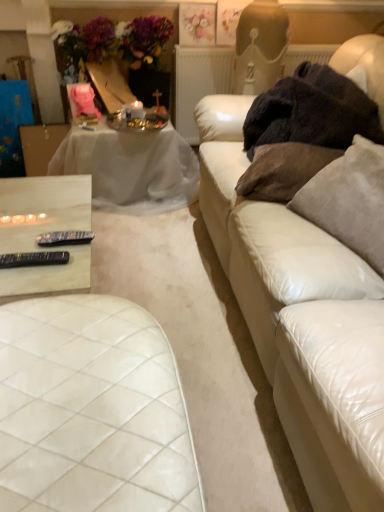
This screenshot has width=384, height=512. Describe the element at coordinates (33, 259) in the screenshot. I see `black plastic remote control at lower left, the 1th tableware when ordered from bottom to top` at that location.

Image resolution: width=384 pixels, height=512 pixels. What do you see at coordinates (42, 209) in the screenshot? I see `white marble remote controls at lower left, which is counted as the first table, starting from the front` at bounding box center [42, 209].

Find the location of a particular element. Image resolution: width=384 pixels, height=512 pixels. white marble remote controls at lower left, the 2th table in the back-to-front sequence is located at coordinates (42, 209).

In order to face pastel floral print at upper center, should I rotate leftwards or rightwards?

A 0.760 degree turn to the right will do.

Describe the element at coordinates (199, 23) in the screenshot. The height and width of the screenshot is (512, 384). I see `pastel floral print at upper center` at that location.

The image size is (384, 512). What do you see at coordinates (91, 410) in the screenshot? I see `white quilted leather ottoman at lower left` at bounding box center [91, 410].

Measure the distance between white quilted leather ottoman at lower left and camera.

The depth of white quilted leather ottoman at lower left is 31.48 inches.

Where is `white sheer cloth at upper left, marked as the 2th table in a front-to-back arrangement`? white sheer cloth at upper left, marked as the 2th table in a front-to-back arrangement is located at coordinates (131, 168).

Image resolution: width=384 pixels, height=512 pixels. I want to click on black plastic remote control at lower left, the first tableware positioned from the front, so click(x=33, y=259).

Measure the distance from pastel floral print at upper center to dark fuzzy blanket at right.

A distance of 1.10 meters exists between pastel floral print at upper center and dark fuzzy blanket at right.

Considering the positions of points (185, 22) and (327, 122), is point (185, 22) closer to camera compared to point (327, 122)?

No, (185, 22) is behind (327, 122).

Identify the location of flower behind the dark fuzzy blanket at right. (199, 23).

Does pastel floral print at upper center have a lesser width compared to dark fuzzy blanket at right?

Indeed, pastel floral print at upper center has a lesser width compared to dark fuzzy blanket at right.

Is black plastic remote control at lower left, which appears as the first tableware when viewed from the top, far away from black plastic remote control at lower left, the 1th tableware when ordered from bottom to top?

No, black plastic remote control at lower left, which appears as the first tableware when viewed from the top, is in close proximity to black plastic remote control at lower left, the 1th tableware when ordered from bottom to top.

You are a GUI agent. You are given a task and a screenshot of the screen. Output one action in this format:
    pyautogui.click(x=<x>, y=<y>)
    Task: Click on the tableware above the black plastic remote control at lower left, the first tableware positioned from the front (from the image's perspective)
    This screenshot has height=512, width=384.
    Given the screenshot: What is the action you would take?
    pyautogui.click(x=64, y=238)

Between black plastic remote control at lower left, marked as the 1th tableware in a back-to-front arrangement, and black plastic remote control at lower left, the 2th tableware in the back-to-front sequence, which one has more height?

Standing taller between the two is black plastic remote control at lower left, marked as the 1th tableware in a back-to-front arrangement.

From the picture: Does black plastic remote control at lower left, which appears as the first tableware when viewed from the top, have a greater width compared to black plastic remote control at lower left, arranged as the 2th tableware when viewed from the top?

Yes.

Consider the image. In terms of size, does brown fabric pillow at right, which ranks as the second pillow in right-to-left order, appear bigger or smaller than dark fuzzy blanket at right?

Clearly, brown fabric pillow at right, which ranks as the second pillow in right-to-left order, is smaller in size than dark fuzzy blanket at right.

From a real-world perspective, is brown fabric pillow at right, which ranks as the first pillow in left-to-right order, on dark fuzzy blanket at right?

No.

Can you tell me how much brown fabric pillow at right, which ranks as the first pillow in left-to-right order, and dark fuzzy blanket at right differ in facing direction?

The angular difference between brown fabric pillow at right, which ranks as the first pillow in left-to-right order, and dark fuzzy blanket at right is 12.7 degrees.

Is brown fabric pillow at right, which ranks as the second pillow in right-to-left order, with dark fuzzy blanket at right?

No, brown fabric pillow at right, which ranks as the second pillow in right-to-left order, is not touching dark fuzzy blanket at right.

Between brown fabric pillow at right, which ranks as the first pillow in left-to-right order, and white marble remote controls at lower left, which is counted as the first table, starting from the front, which one is positioned in front?

white marble remote controls at lower left, which is counted as the first table, starting from the front.

Considering the relative sizes of brown fabric pillow at right, which ranks as the first pillow in left-to-right order, and white marble remote controls at lower left, which is counted as the first table, starting from the front, in the image provided, is brown fabric pillow at right, which ranks as the first pillow in left-to-right order, shorter than white marble remote controls at lower left, which is counted as the first table, starting from the front,?

Yes.

Is brown fabric pillow at right, which ranks as the second pillow in right-to-left order, bigger than white marble remote controls at lower left, which is counted as the first table, starting from the front?

Incorrect, brown fabric pillow at right, which ranks as the second pillow in right-to-left order, is not larger than white marble remote controls at lower left, which is counted as the first table, starting from the front.

From the white marble remote controls at lower left, marked as the first table in a bottom-to-top arrangement, count 1st pillow to the right and point to it. Please provide its 2D coordinates.

[(283, 170)]

Can white leather couch at right be found inside black plastic remote control at lower left, which appears as the first tableware when viewed from the top?

No.

Is black plastic remote control at lower left, the 2th tableware from the front, bigger or smaller than white leather couch at right?

In the image, black plastic remote control at lower left, the 2th tableware from the front, appears to be smaller than white leather couch at right.

Considering the positions of points (57, 234) and (213, 234), is point (57, 234) farther from camera compared to point (213, 234)?

No, (57, 234) is closer to viewer.

Is black plastic remote control at lower left, marked as the 1th tableware in a back-to-front arrangement, thinner than white leather couch at right?

Correct, the width of black plastic remote control at lower left, marked as the 1th tableware in a back-to-front arrangement, is less than that of white leather couch at right.

Does point (16, 202) come in front of point (317, 347)?

No, it is behind (317, 347).

Is white marble remote controls at lower left, the 2th table in the back-to-front sequence, behind white leather couch at right?

Yes, the depth of white marble remote controls at lower left, the 2th table in the back-to-front sequence, is greater than that of white leather couch at right.

Locate an element on the screen. The image size is (384, 512). the 1st table behind the white leather couch at right is located at coordinates (42, 209).

Considering the sizes of objects white marble remote controls at lower left, the 2th table positioned from the top, and white leather couch at right in the image provided, who is bigger, white marble remote controls at lower left, the 2th table positioned from the top, or white leather couch at right?

white leather couch at right is bigger.

Is the depth of black plastic remote control at lower left, the 2th tableware from the front, less than that of white sheer cloth at upper left, which is the first table in top-to-bottom order?

Yes.

In terms of height, does black plastic remote control at lower left, marked as the 1th tableware in a back-to-front arrangement, look taller or shorter compared to white sheer cloth at upper left, which is the first table in top-to-bottom order?

Clearly, black plastic remote control at lower left, marked as the 1th tableware in a back-to-front arrangement, is shorter compared to white sheer cloth at upper left, which is the first table in top-to-bottom order.

Considering the relative sizes of black plastic remote control at lower left, which appears as the first tableware when viewed from the top, and white sheer cloth at upper left, which is the first table in top-to-bottom order, in the image provided, is black plastic remote control at lower left, which appears as the first tableware when viewed from the top, wider than white sheer cloth at upper left, which is the first table in top-to-bottom order,?

Incorrect, the width of black plastic remote control at lower left, which appears as the first tableware when viewed from the top, does not surpass that of white sheer cloth at upper left, which is the first table in top-to-bottom order.

Based on the photo, is black plastic remote control at lower left, the 2th tableware from the front, bigger than white sheer cloth at upper left, positioned as the first table in back-to-front order?

No, black plastic remote control at lower left, the 2th tableware from the front, is not bigger than white sheer cloth at upper left, positioned as the first table in back-to-front order.

The width and height of the screenshot is (384, 512). I want to click on blanket that is in front of the pastel floral print at upper center, so click(x=312, y=111).

Where is `tableware lying on the left of black plastic remote control at lower left, which is counted as the second tableware, starting from the bottom`? tableware lying on the left of black plastic remote control at lower left, which is counted as the second tableware, starting from the bottom is located at coordinates (33, 259).

Based on their spatial positions, is suede-like beige pillow at right, which is counted as the second pillow, starting from the left, or white marble remote controls at lower left, the 2th table positioned from the top, further from white leather couch at right?

Among the two, white marble remote controls at lower left, the 2th table positioned from the top, is located further to white leather couch at right.

From the image, which object appears to be nearer to black plastic remote control at lower left, the 2th tableware from the front, white quilted leather ottoman at lower left or suede-like beige pillow at right, which is counted as the second pillow, starting from the left?

Among the two, white quilted leather ottoman at lower left is located nearer to black plastic remote control at lower left, the 2th tableware from the front.

Estimate the real-world distances between objects in this image. Which object is further from pastel floral print at upper center, white quilted leather ottoman at lower left or black plastic remote control at lower left, the 2th tableware in the back-to-front sequence?

white quilted leather ottoman at lower left is further to pastel floral print at upper center.

Estimate the real-world distances between objects in this image. Which object is further from brown fabric pillow at right, which ranks as the second pillow in right-to-left order, white leather couch at right or black plastic remote control at lower left, the 2th tableware in the back-to-front sequence?

Among the two, black plastic remote control at lower left, the 2th tableware in the back-to-front sequence, is located further to brown fabric pillow at right, which ranks as the second pillow in right-to-left order.

When comparing their distances from white marble remote controls at lower left, which is counted as the first table, starting from the front, does brown fabric pillow at right, which ranks as the first pillow in left-to-right order, or black plastic remote control at lower left, arranged as the 2th tableware when viewed from the top, seem further?

brown fabric pillow at right, which ranks as the first pillow in left-to-right order.

When comparing their distances from dark fuzzy blanket at right, does brown fabric pillow at right, which ranks as the second pillow in right-to-left order, or white marble remote controls at lower left, the 2th table positioned from the top, seem further?

white marble remote controls at lower left, the 2th table positioned from the top, is positioned further to the anchor dark fuzzy blanket at right.

Which object lies nearer to the anchor point black plastic remote control at lower left, the 2th tableware in the back-to-front sequence, white leather couch at right or black plastic remote control at lower left, which appears as the first tableware when viewed from the top?

Among the two, black plastic remote control at lower left, which appears as the first tableware when viewed from the top, is located nearer to black plastic remote control at lower left, the 2th tableware in the back-to-front sequence.

Estimate the real-world distances between objects in this image. Which object is closer to white sheer cloth at upper left, marked as the 2th table in a front-to-back arrangement, dark fuzzy blanket at right or pastel floral print at upper center?

dark fuzzy blanket at right is closer to white sheer cloth at upper left, marked as the 2th table in a front-to-back arrangement.

Locate an element on the screen. The image size is (384, 512). flower between white sheer cloth at upper left, which is the first table in top-to-bottom order, and dark fuzzy blanket at right is located at coordinates (199, 23).

You are a GUI agent. You are given a task and a screenshot of the screen. Output one action in this format:
    pyautogui.click(x=<x>, y=<y>)
    Task: Click on the blanket between black plastic remote control at lower left, the first tableware positioned from the front, and suede-like beige pillow at right, which is counted as the second pillow, starting from the left
    The width and height of the screenshot is (384, 512).
    Given the screenshot: What is the action you would take?
    pyautogui.click(x=312, y=111)

Locate an element on the screen. Image resolution: width=384 pixels, height=512 pixels. pillow situated between black plastic remote control at lower left, the 1th tableware when ordered from bottom to top, and suede-like beige pillow at right, which is the first pillow in right-to-left order, from left to right is located at coordinates (283, 170).

Where is `blanket between suede-like beige pillow at right, which is the first pillow in right-to-left order, and pastel floral print at upper center, along the z-axis`? This screenshot has width=384, height=512. blanket between suede-like beige pillow at right, which is the first pillow in right-to-left order, and pastel floral print at upper center, along the z-axis is located at coordinates (312, 111).